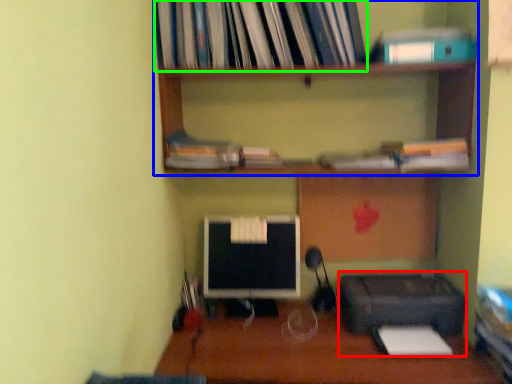
Question: Considering the real-world distances, which object is farthest from printer (highlighted by a red box)? shelf (highlighted by a blue box) or book (highlighted by a green box)?

Choices:
 (A) shelf
 (B) book

Answer: (B)